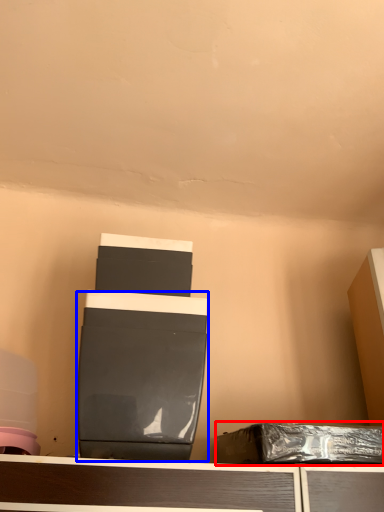
Question: Among these objects, which one is nearest to the camera, waste (highlighted by a red box) or wide (highlighted by a blue box)?

Choices:
 (A) waste
 (B) wide

Answer: (B)